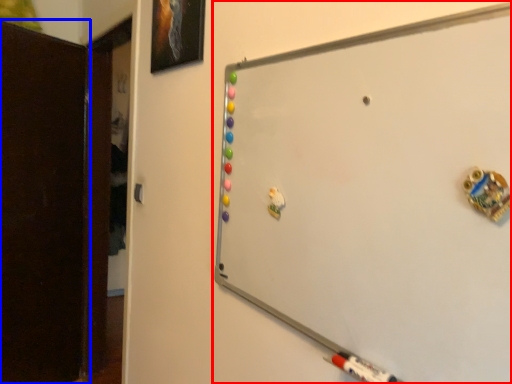
Question: Which of the following is the farthest to the observer, whiteboard (highlighted by a red box) or door (highlighted by a blue box)?

Choices:
 (A) whiteboard
 (B) door

Answer: (B)